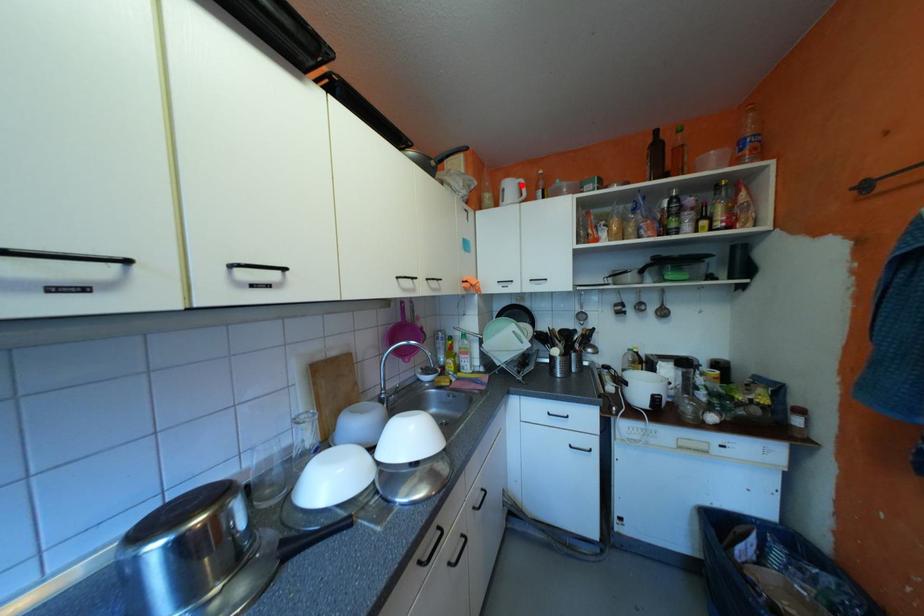
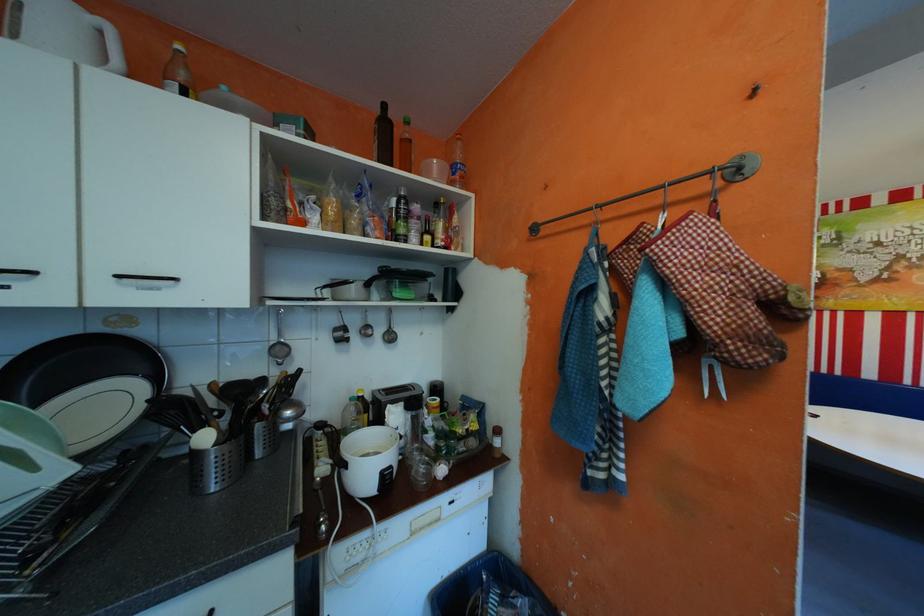
The point at the highlighted location is marked in the first image. Where is the corresponding point in the second image?

(66, 12)